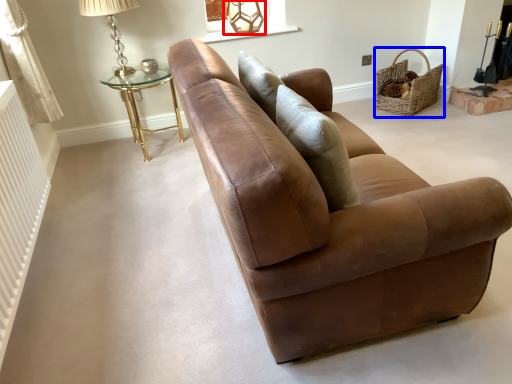
Question: Which of the following is the closest to the observer, table lamp (highlighted by a red box) or basket (highlighted by a blue box)?

Choices:
 (A) table lamp
 (B) basket

Answer: (B)